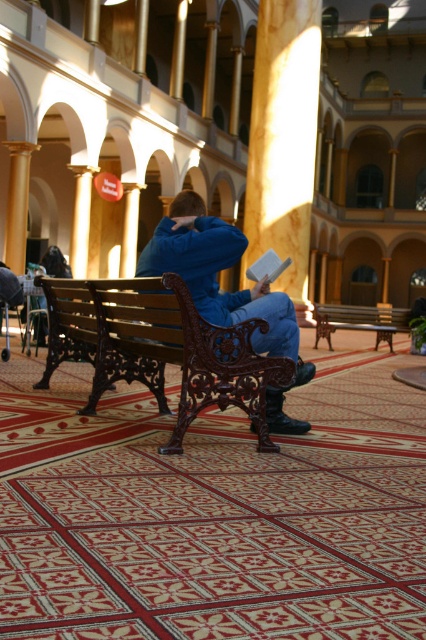
Is smooth wooden pillar at center to the left of blue fleece jacket at center from the viewer's perspective?

No, smooth wooden pillar at center is not to the left of blue fleece jacket at center.

What do you see at coordinates (284, 140) in the screenshot? I see `smooth wooden pillar at center` at bounding box center [284, 140].

Image resolution: width=426 pixels, height=640 pixels. Identify the location of smooth wooden pillar at center. (284, 140).

Is blue fleece jacket at center to the right of white matte book at center from the viewer's perspective?

Incorrect, blue fleece jacket at center is not on the right side of white matte book at center.

Which is in front, point (164, 221) or point (273, 252)?

Point (164, 221) is more forward.

Is point (158, 225) closer to viewer compared to point (256, 266)?

That is True.

Locate an element on the screen. The width and height of the screenshot is (426, 640). blue fleece jacket at center is located at coordinates (215, 273).

Does polished dark wood bench at center appear on the left side of smooth wooden pillar at center?

Indeed, polished dark wood bench at center is positioned on the left side of smooth wooden pillar at center.

What do you see at coordinates (158, 348) in the screenshot? The image size is (426, 640). I see `polished dark wood bench at center` at bounding box center [158, 348].

What do you see at coordinates (158, 348) in the screenshot? The width and height of the screenshot is (426, 640). I see `polished dark wood bench at center` at bounding box center [158, 348].

This screenshot has width=426, height=640. I want to click on polished dark wood bench at center, so click(x=158, y=348).